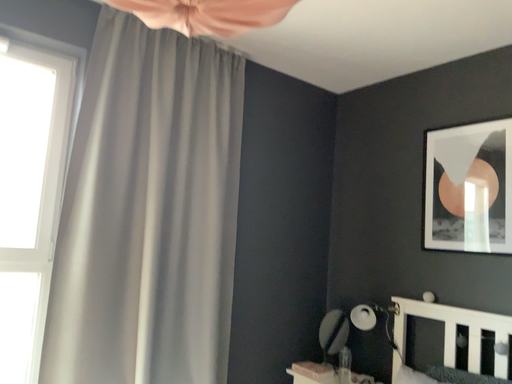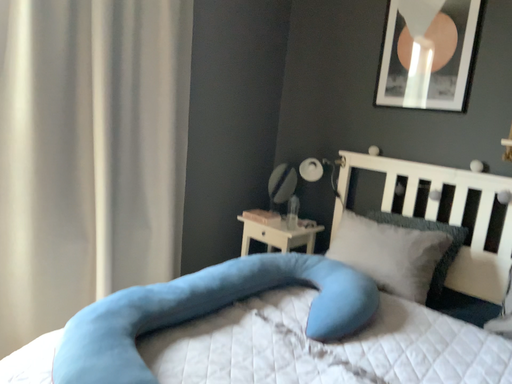
Question: How did the camera likely rotate when shooting the video?

Choices:
 (A) rotated upward
 (B) rotated downward

Answer: (B)